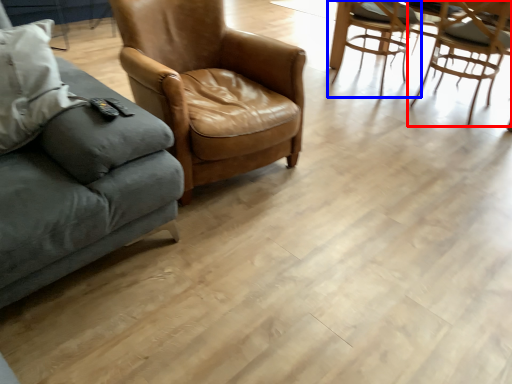
Question: Which point is closer to the camera, chair (highlighted by a red box) or chair (highlighted by a blue box)?

Choices:
 (A) chair
 (B) chair

Answer: (A)